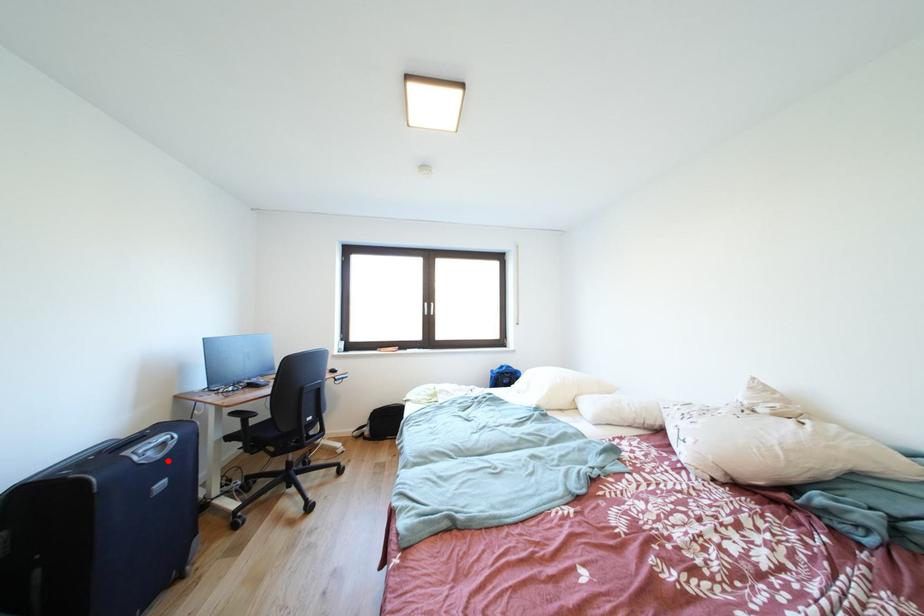
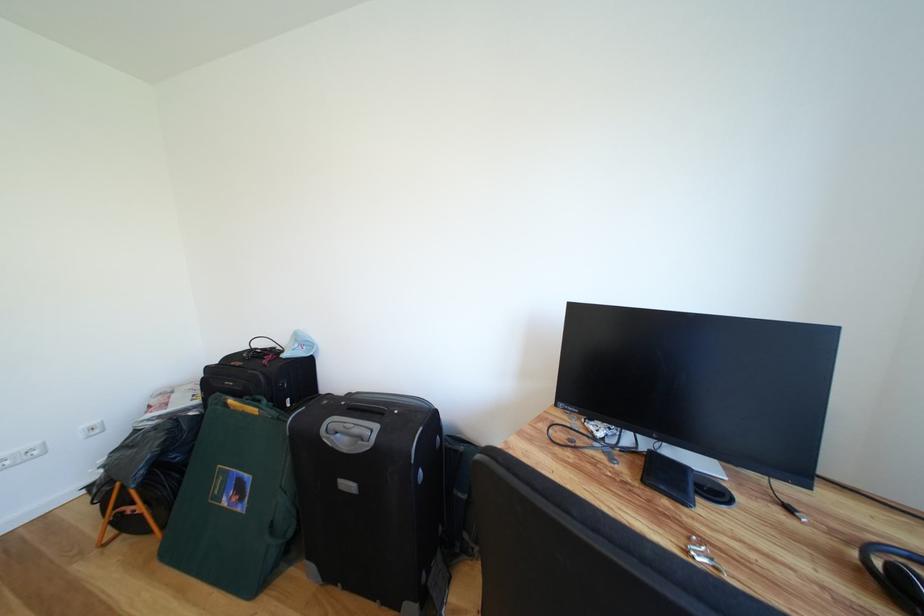
The point at the highlighted location is marked in the first image. Where is the corresponding point in the second image?

(353, 455)